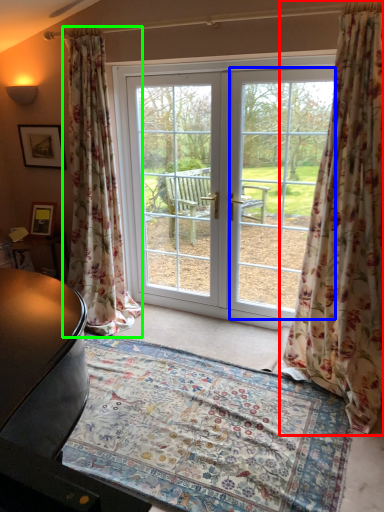
Question: Considering the real-world distances, which object is closest to curtain (highlighted by a red box)? window screen (highlighted by a blue box) or curtain (highlighted by a green box).

Choices:
 (A) window screen
 (B) curtain

Answer: (A)